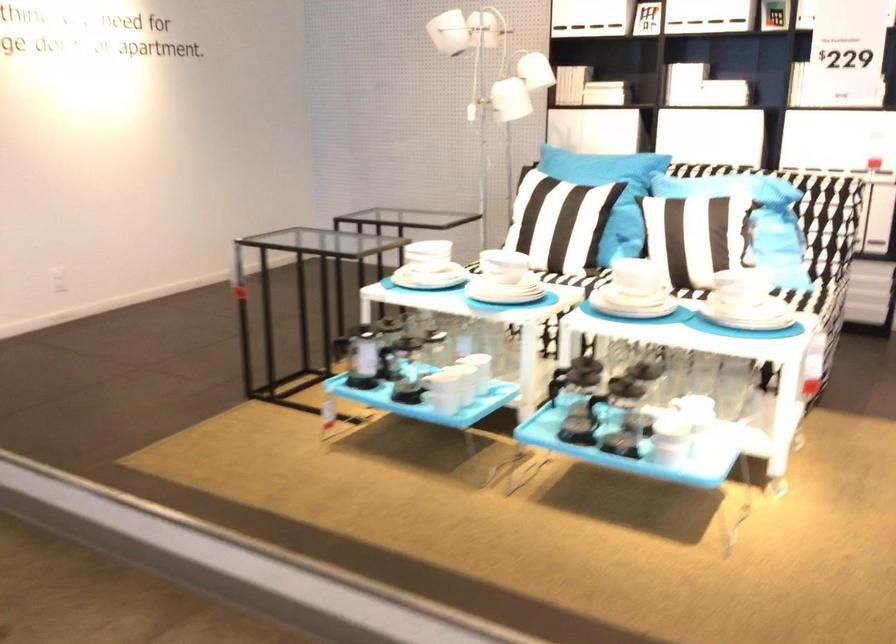
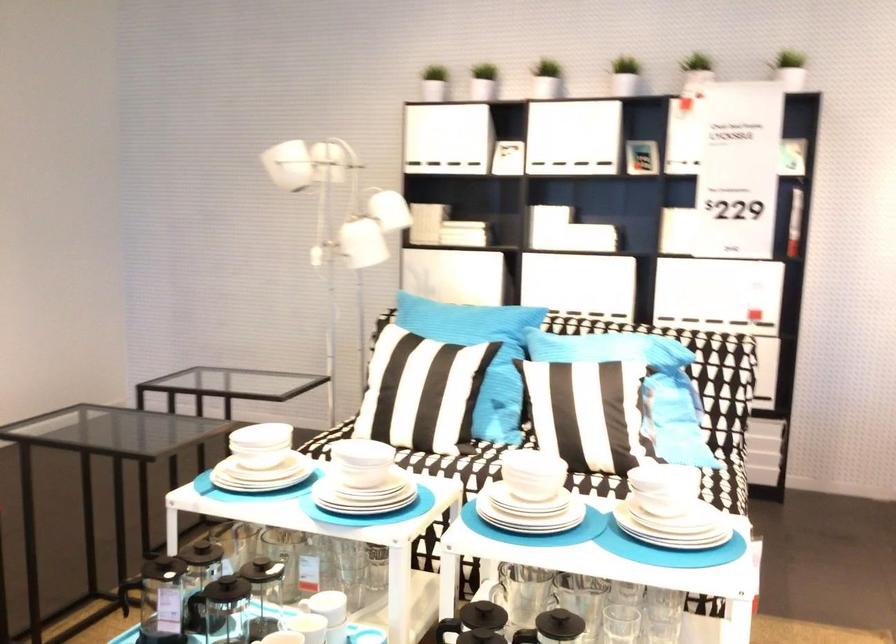
Locate, in the second image, the point that corresponds to (509,90) in the first image.

(362, 243)